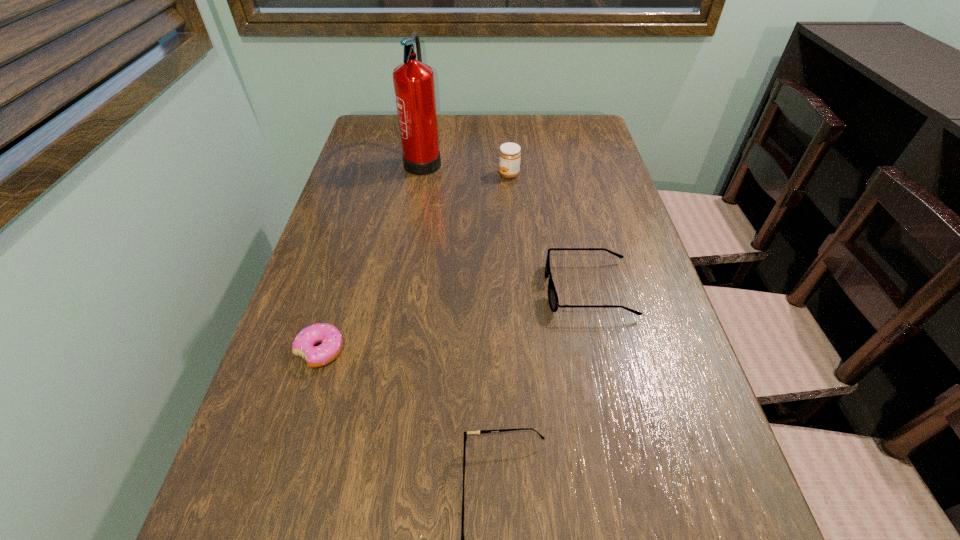
I want to click on the closest object to the rightmost object, so click(500, 430).